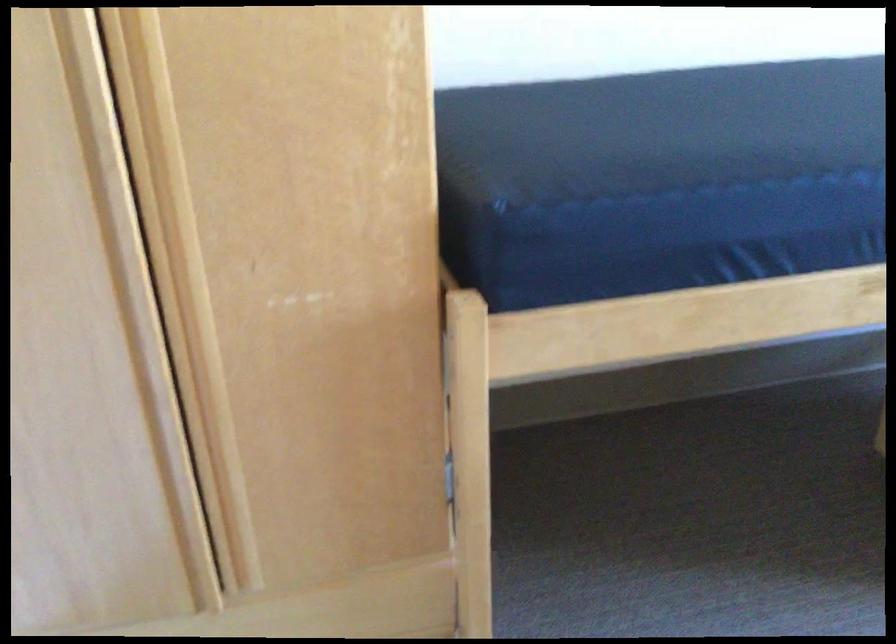
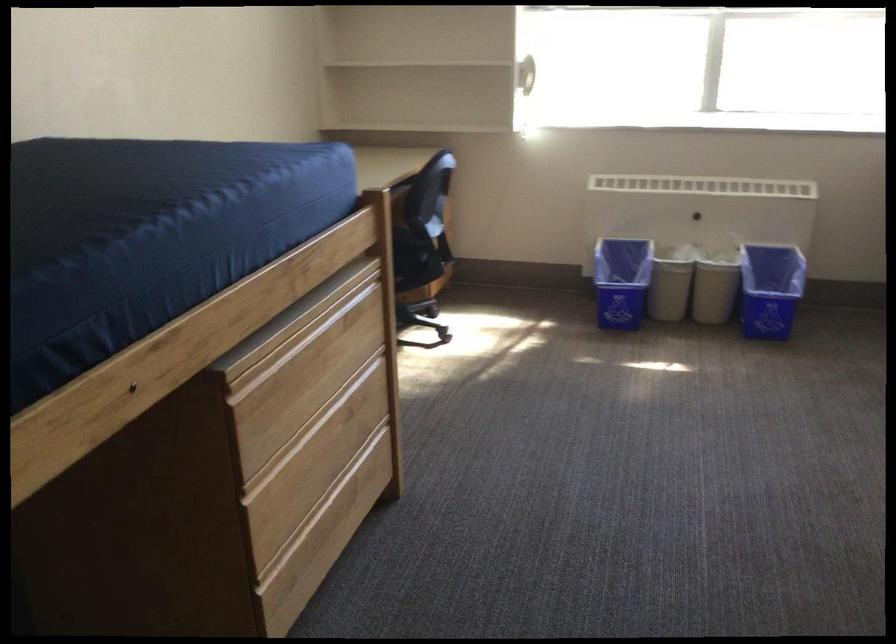
Question: Based on the continuous images, in which direction is the camera rotating? Reply with the corresponding letter.

Choices:
 (A) Left
 (B) Right
 (C) Up
 (D) Down

Answer: (B)